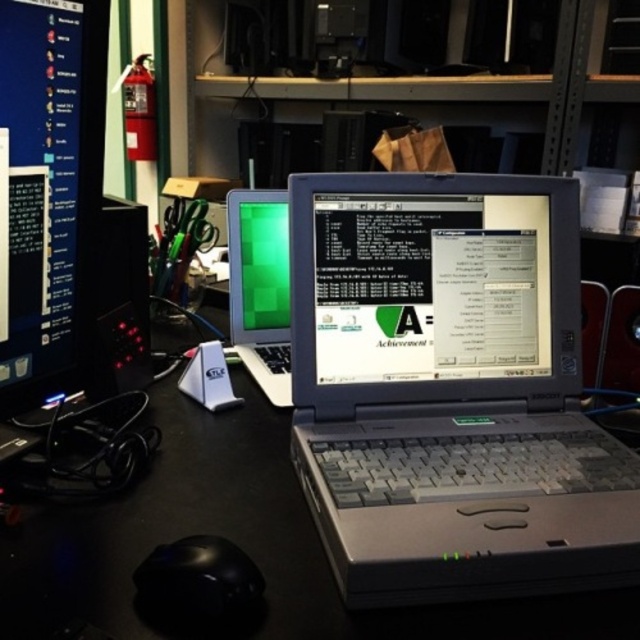
Does shiny silver laptop at center have a greater width compared to matte black monitor at left?

Correct, the width of shiny silver laptop at center exceeds that of matte black monitor at left.

Is shiny silver laptop at center further to camera compared to matte black monitor at left?

Yes, shiny silver laptop at center is behind matte black monitor at left.

Is point (518, 250) in front of point (83, 205)?

No, it is not.

You are a GUI agent. You are given a task and a screenshot of the screen. Output one action in this format:
    pyautogui.click(x=<x>, y=<y>)
    Task: Click on the shiny silver laptop at center
    The image size is (640, 640).
    Given the screenshot: What is the action you would take?
    pyautogui.click(x=433, y=289)

Who is positioned more to the left, silver metallic laptop at center or black glossy mouse at lower left?

From the viewer's perspective, black glossy mouse at lower left appears more on the left side.

Between point (380, 518) and point (243, 570), which one is positioned behind?

Point (380, 518)

Does point (314, 248) come farther from viewer compared to point (237, 560)?

Yes.

You are a GUI agent. You are given a task and a screenshot of the screen. Output one action in this format:
    pyautogui.click(x=<x>, y=<y>)
    Task: Click on the silver metallic laptop at center
    This screenshot has width=640, height=640.
    Given the screenshot: What is the action you would take?
    pyautogui.click(x=449, y=390)

Can you confirm if black plastic table at center is shorter than black glossy mouse at lower left?

No.

Can you confirm if black plastic table at center is smaller than black glossy mouse at lower left?

No.

The height and width of the screenshot is (640, 640). What are the coordinates of `black plastic table at center` in the screenshot? It's located at (240, 545).